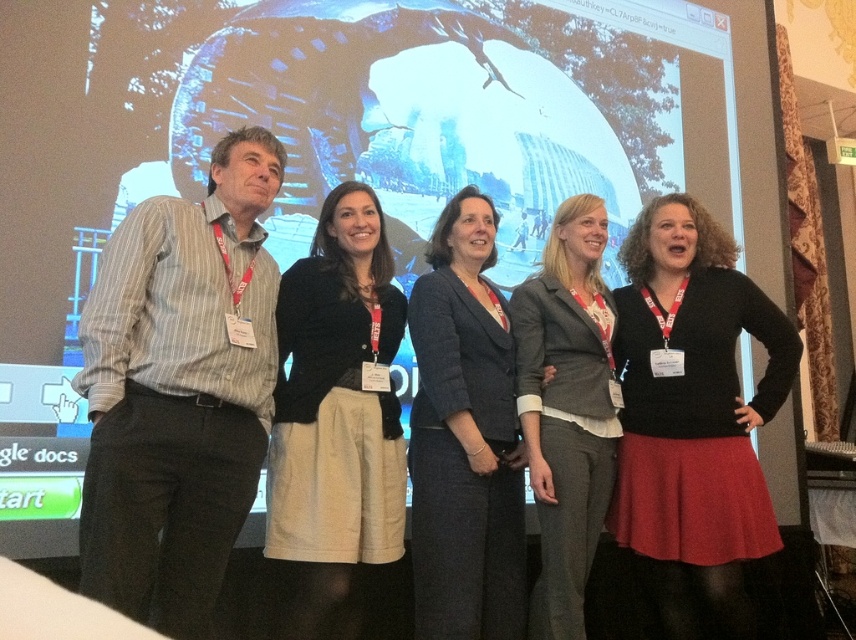
Does matte black sweater at center come in front of dark gray suit at center?

Yes, matte black sweater at center is in front of dark gray suit at center.

Locate an element on the screen. matte black sweater at center is located at coordinates (336, 420).

Locate an element on the screen. matte black sweater at center is located at coordinates (336, 420).

Is matte black sweater at center positioned in front of gray wool blazer at center?

That is True.

Does matte black sweater at center have a lesser width compared to gray wool blazer at center?

No, matte black sweater at center is not thinner than gray wool blazer at center.

Is point (306, 417) positioned after point (562, 456)?

No, it is not.

The image size is (856, 640). In order to click on matte black sweater at center in this screenshot , I will do `click(336, 420)`.

Based on the photo, who is more distant from viewer, (720, 298) or (331, 545)?

Point (720, 298)

Between point (712, 602) and point (367, 228), which one is positioned in front?

Point (712, 602)

The height and width of the screenshot is (640, 856). Identify the location of black sweater at center. (693, 416).